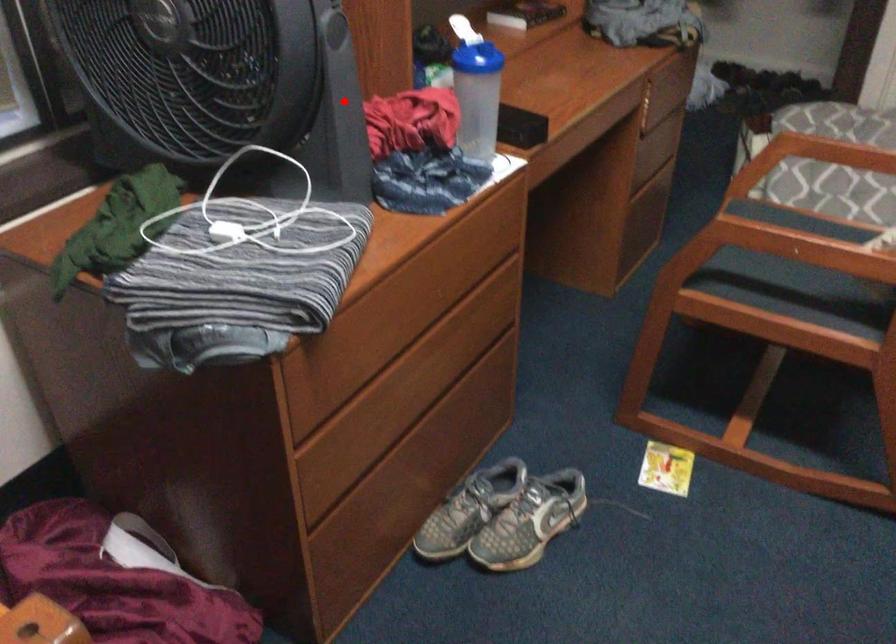
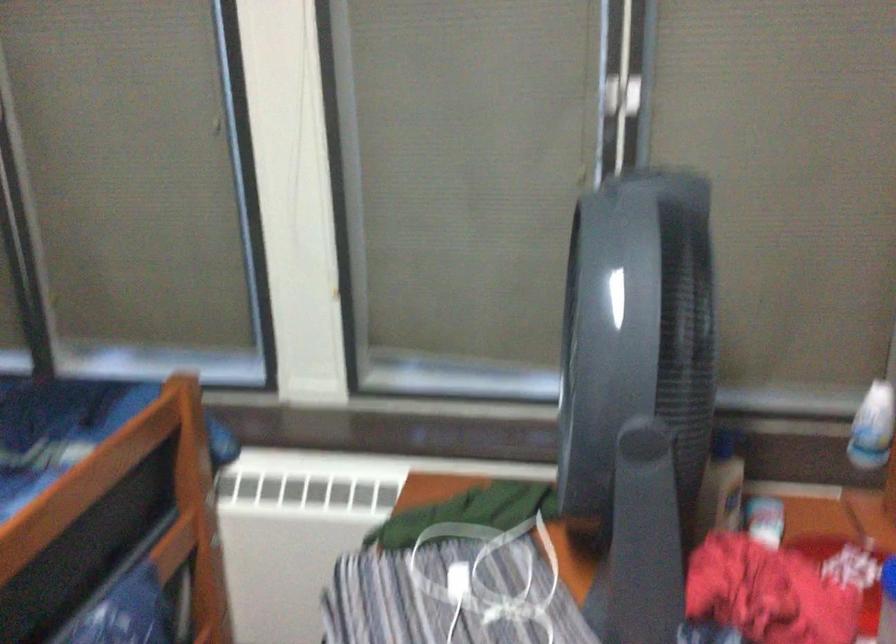
The point at the highlighted location is marked in the first image. Where is the corresponding point in the second image?

(645, 521)